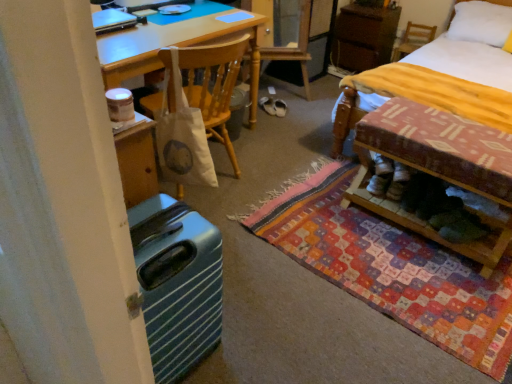
Question: Does brown wood cabinet at upper right have a lesser width compared to wooden bed frame at lower right?

Choices:
 (A) yes
 (B) no

Answer: (B)

Question: Considering the relative sizes of brown wood cabinet at upper right and wooden bed frame at lower right in the image provided, is brown wood cabinet at upper right shorter than wooden bed frame at lower right?

Choices:
 (A) yes
 (B) no

Answer: (A)

Question: From a real-world perspective, is brown wood cabinet at upper right on wooden bed frame at lower right?

Choices:
 (A) no
 (B) yes

Answer: (B)

Question: From the image's perspective, is brown wood cabinet at upper right on wooden bed frame at lower right?

Choices:
 (A) yes
 (B) no

Answer: (A)

Question: Can we say brown wood cabinet at upper right lies outside wooden bed frame at lower right?

Choices:
 (A) no
 (B) yes

Answer: (B)

Question: From a real-world perspective, is white fabric shoe at center, marked as the first footwear in a left-to-right arrangement, above or below multicolored woven mat at lower right?

Choices:
 (A) below
 (B) above

Answer: (B)

Question: Which is correct: white fabric shoe at center, marked as the 2th footwear in a right-to-left arrangement, is inside multicolored woven mat at lower right, or outside of it?

Choices:
 (A) inside
 (B) outside

Answer: (B)

Question: Considering the relative positions of white fabric shoe at center, marked as the 2th footwear in a right-to-left arrangement, and multicolored woven mat at lower right in the image provided, is white fabric shoe at center, marked as the 2th footwear in a right-to-left arrangement, to the left or to the right of multicolored woven mat at lower right?

Choices:
 (A) left
 (B) right

Answer: (A)

Question: Is white fabric shoe at center, marked as the first footwear in a left-to-right arrangement, in front of or behind multicolored woven mat at lower right in the image?

Choices:
 (A) behind
 (B) front

Answer: (A)

Question: Considering the positions of point (272, 109) and point (181, 59), is point (272, 109) closer or farther from the camera than point (181, 59)?

Choices:
 (A) closer
 (B) farther

Answer: (B)

Question: Is white fabric shoe at center, marked as the 2th footwear in a right-to-left arrangement, in front of or behind white canvas bag at center, the 1th chair in the left-to-right sequence, in the image?

Choices:
 (A) behind
 (B) front

Answer: (A)

Question: Is white fabric shoe at center, marked as the first footwear in a left-to-right arrangement, situated inside white canvas bag at center, the 2th chair positioned from the back, or outside?

Choices:
 (A) outside
 (B) inside

Answer: (A)

Question: Considering the positions of white fabric shoe at center, marked as the 2th footwear in a right-to-left arrangement, and white canvas bag at center, the 1th chair when ordered from bottom to top, in the image, is white fabric shoe at center, marked as the 2th footwear in a right-to-left arrangement, wider or thinner than white canvas bag at center, the 1th chair when ordered from bottom to top,?

Choices:
 (A) wide
 (B) thin

Answer: (A)

Question: Is yellow fabric bed at lower right spatially inside multicolored woven mat at lower right, or outside of it?

Choices:
 (A) inside
 (B) outside

Answer: (B)

Question: Relative to multicolored woven mat at lower right, is yellow fabric bed at lower right in front or behind?

Choices:
 (A) front
 (B) behind

Answer: (B)